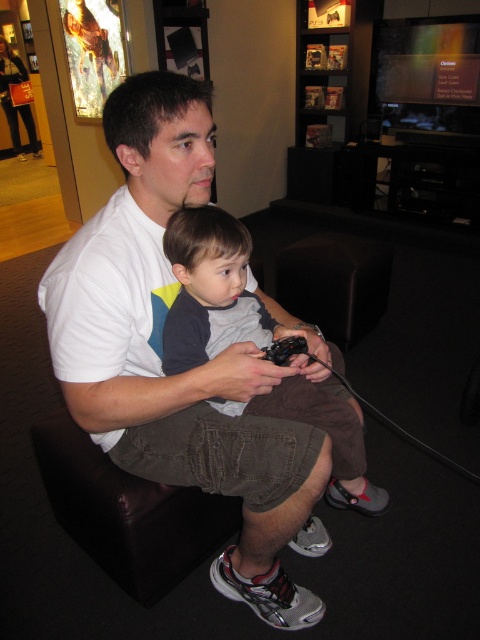
Can you confirm if white cotton shirt at center is wider than gray cotton shirt at center?

Indeed, white cotton shirt at center has a greater width compared to gray cotton shirt at center.

Is point (229, 444) positioned after point (215, 216)?

Yes, it is.

You are a GUI agent. You are given a task and a screenshot of the screen. Output one action in this format:
    pyautogui.click(x=<x>, y=<y>)
    Task: Click on the white cotton shirt at center
    
    Given the screenshot: What is the action you would take?
    pyautogui.click(x=160, y=349)

You are a GUI agent. You are given a task and a screenshot of the screen. Output one action in this format:
    pyautogui.click(x=<x>, y=<y>)
    Task: Click on the white cotton shirt at center
    
    Given the screenshot: What is the action you would take?
    pyautogui.click(x=160, y=349)